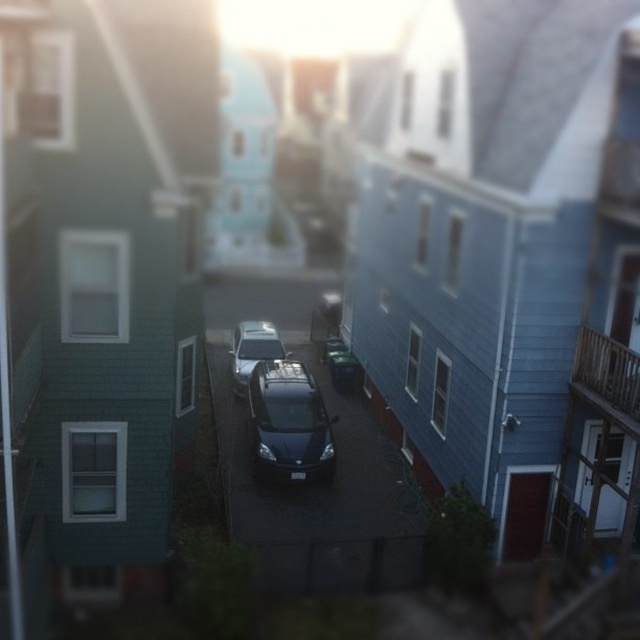
Question: Among these objects, which one is farthest from the camera?

Choices:
 (A) satin silver car at center
 (B) matte black car at center

Answer: (A)

Question: Can you confirm if matte black car at center is positioned above satin silver car at center?

Choices:
 (A) no
 (B) yes

Answer: (A)

Question: Is matte black car at center smaller than satin silver car at center?

Choices:
 (A) yes
 (B) no

Answer: (B)

Question: Can you confirm if matte black car at center is thinner than satin silver car at center?

Choices:
 (A) no
 (B) yes

Answer: (A)